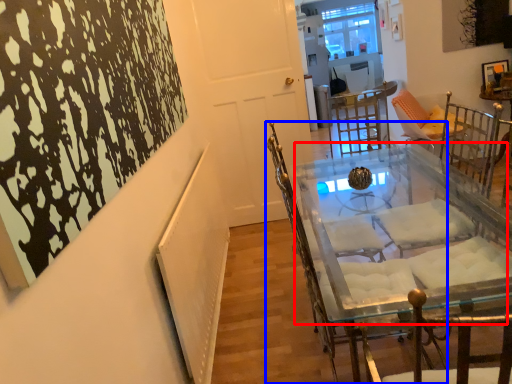
Question: Which object is closer to the camera taking this photo, round table (highlighted by a red box) or chair (highlighted by a blue box)?

Choices:
 (A) round table
 (B) chair

Answer: (A)